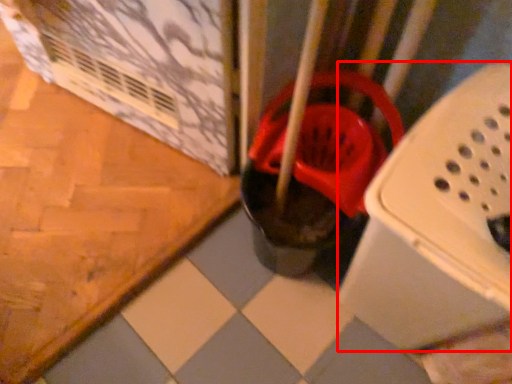
Question: From the image, what is the correct spatial relationship of box (annotated by the red box) in relation to footwear?

Choices:
 (A) left
 (B) right

Answer: (B)